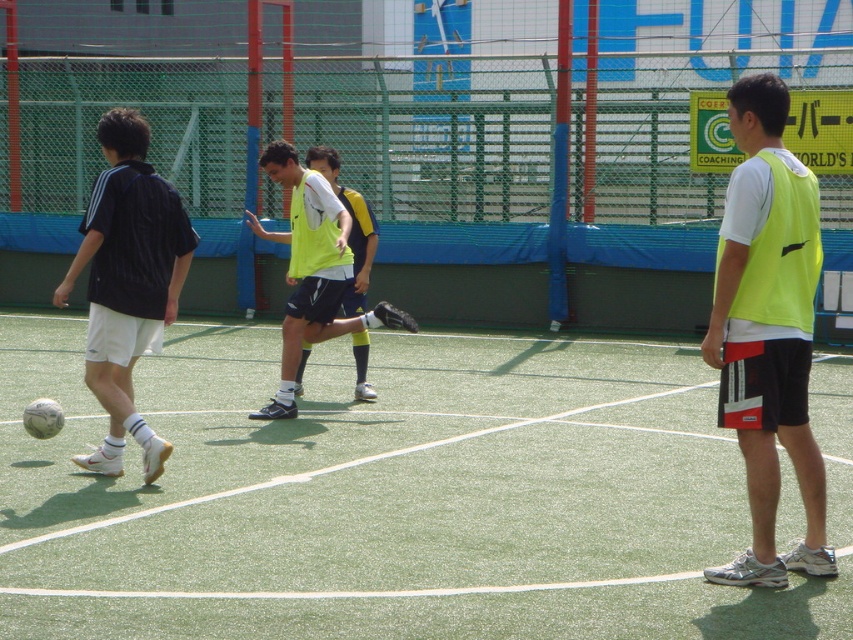
Does green artificial turf at center appear under black matte shirt at left?

Yes.

Between green artificial turf at center and black matte shirt at left, which one is positioned lower?

Positioned lower is green artificial turf at center.

Which is behind, point (515, 374) or point (115, 353)?

Positioned behind is point (515, 374).

Where is `green artificial turf at center`? green artificial turf at center is located at coordinates (387, 497).

Does green artificial turf at center have a larger size compared to neon yellow vest at right?

Indeed, green artificial turf at center has a larger size compared to neon yellow vest at right.

Which of these two, green artificial turf at center or neon yellow vest at right, stands taller?

neon yellow vest at right

Between point (654, 579) and point (761, 371), which one is positioned behind?

Positioned behind is point (761, 371).

Where is `green artificial turf at center`? The image size is (853, 640). green artificial turf at center is located at coordinates (387, 497).

Which of these two, neon yellow vest at right or neon yellow jersey at center, stands taller?

neon yellow vest at right

Measure the distance from neon yellow vest at right to neon yellow jersey at center.

They are 5.00 meters apart.

Measure the distance between neon yellow vest at right and camera.

neon yellow vest at right is 7.60 meters away from camera.

At what (x,y) coordinates should I click in order to perform the action: click on neon yellow vest at right. Please return your answer as a coordinate pair (x, y). This screenshot has height=640, width=853. Looking at the image, I should click on (769, 332).